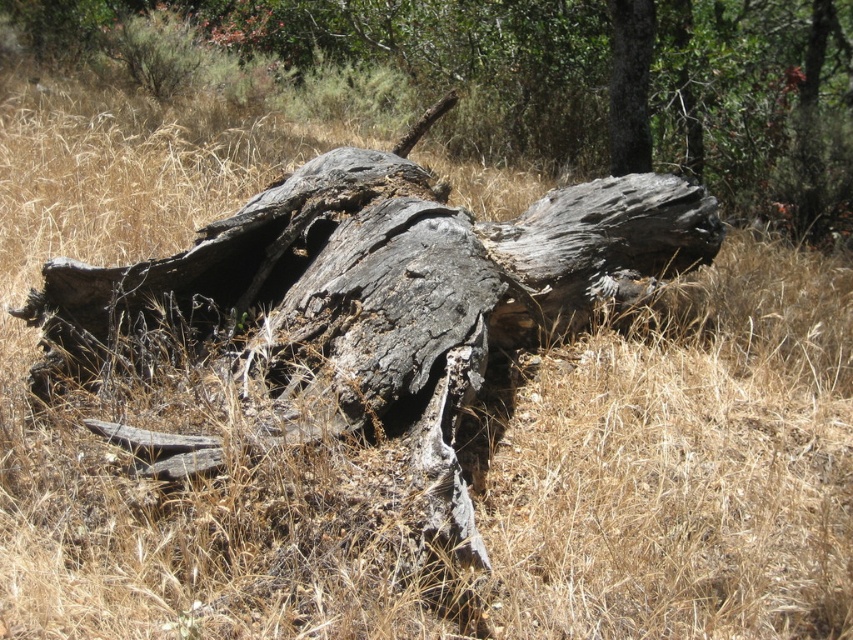
Question: Does charred wood log at center have a smaller size compared to gray rough bark tree trunk at upper center?

Choices:
 (A) yes
 (B) no

Answer: (B)

Question: Which point appears closest to the camera in this image?

Choices:
 (A) (625, 49)
 (B) (498, 96)

Answer: (A)

Question: Does charred wood log at center appear on the left side of gray rough bark tree trunk at upper center?

Choices:
 (A) yes
 (B) no

Answer: (A)

Question: Does charred wood log at center have a smaller size compared to gray rough bark tree trunk at upper center?

Choices:
 (A) yes
 (B) no

Answer: (B)